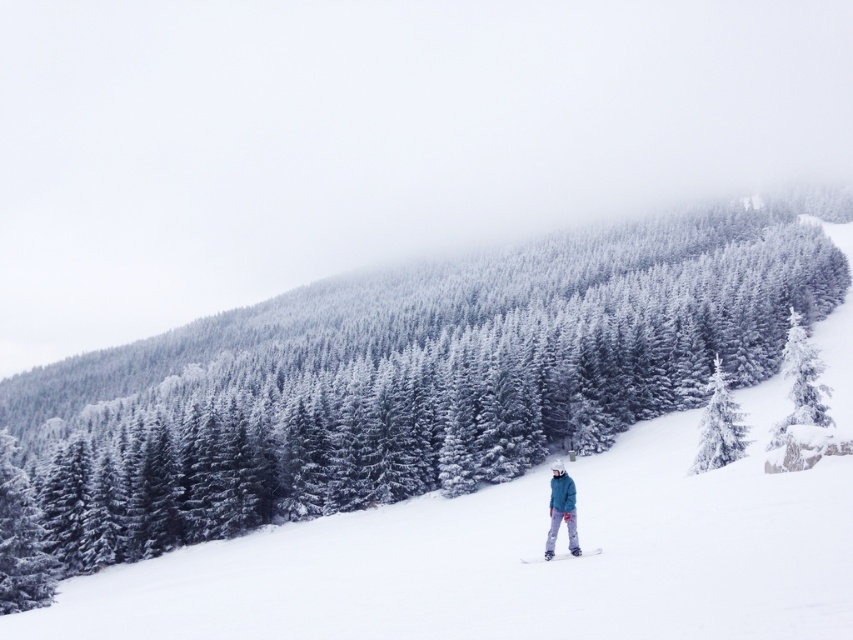
Who is more distant from viewer, (x=732, y=401) or (x=550, y=508)?

The point (x=732, y=401) is behind.

Does white frosty tree at center-right appear on the left side of teal softshell jacket at center?

Incorrect, white frosty tree at center-right is not on the left side of teal softshell jacket at center.

Find the location of a particular element. The image size is (853, 640). white frosty tree at center-right is located at coordinates (718, 426).

Is white frosty tree at upper right positioned at the back of white matte ski at center?

Yes, it is behind white matte ski at center.

Is white frosty tree at upper right to the left of white matte ski at center from the viewer's perspective?

Incorrect, white frosty tree at upper right is not on the left side of white matte ski at center.

You are a GUI agent. You are given a task and a screenshot of the screen. Output one action in this format:
    pyautogui.click(x=<x>, y=<y>)
    Task: Click on the white frosty tree at upper right
    
    Given the screenshot: What is the action you would take?
    pyautogui.click(x=801, y=384)

Locate an element on the screen. Image resolution: width=853 pixels, height=640 pixels. white frosty tree at upper right is located at coordinates (801, 384).

Does point (550, 468) lie in front of point (541, 560)?

That is False.

Can you confirm if teal softshell jacket at center is positioned below white matte ski at center?

No, teal softshell jacket at center is not below white matte ski at center.

Where is `teal softshell jacket at center`? This screenshot has width=853, height=640. teal softshell jacket at center is located at coordinates (561, 512).

The width and height of the screenshot is (853, 640). In order to click on teal softshell jacket at center in this screenshot , I will do `click(561, 512)`.